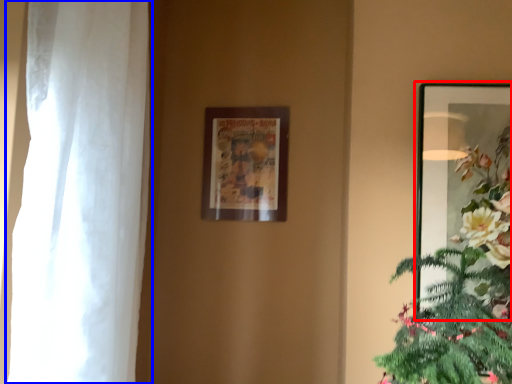
Question: Which object appears closest to the camera in this image, picture frame (highlighted by a red box) or curtain (highlighted by a blue box)?

Choices:
 (A) picture frame
 (B) curtain

Answer: (B)